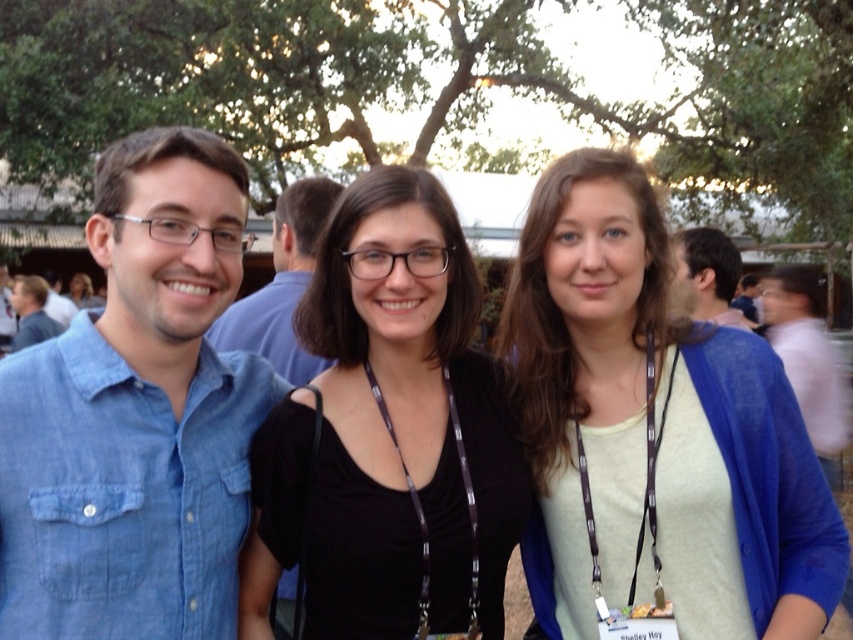
Looking at this image, you are organizing a charity event and need to arrange seating based on clothing sizes. If the light blue cardigan at center and the denim shirt at left are both present, which one requires a larger chair size?

The light blue cardigan at center requires a larger chair size because it has a larger size compared to the denim shirt at left.

You are trying to locate the light blue cardigan at center and the blue denim shirt at upper right in the image. Which one is more to the left?

The light blue cardigan at center is more to the left than the blue denim shirt at upper right.